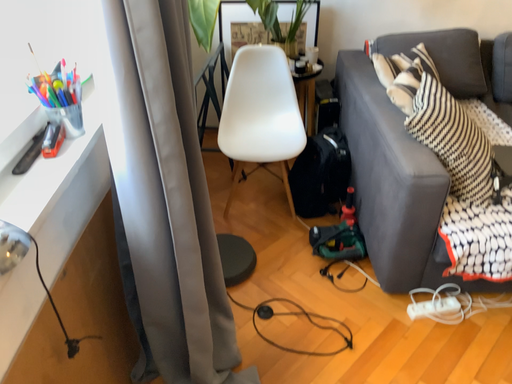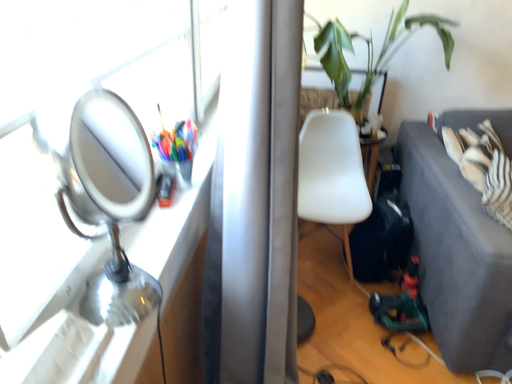
Question: Which way did the camera rotate in the video?

Choices:
 (A) rotated upward
 (B) rotated downward

Answer: (A)